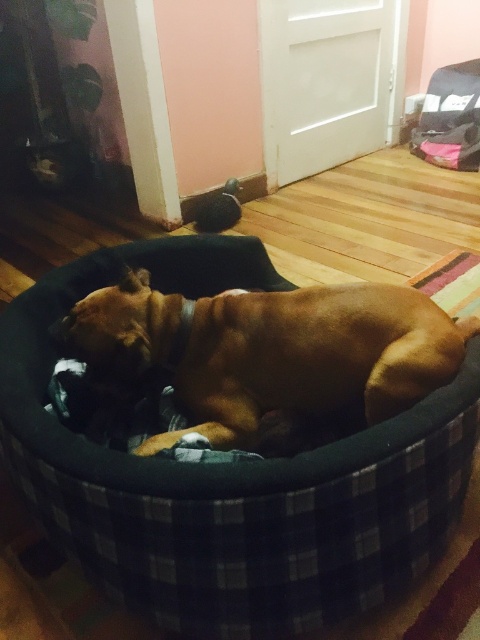
You want to buy a new pet bed for your brown velvety dog at center. The current black plaid dog bed at center is too small. What should you look for in terms of size when purchasing the new bed?

The black plaid dog bed at center has a larger size compared to brown velvety dog at center, so you should look for a bed that is even larger than the current one to ensure comfort and proper fit for the brown velvety dog at center.

You are a dog owner who wants to place a new toy in the black plaid dog bed at center. However, the brown velvety dog at center is currently lying in it. Based on their positions, can you tell me if the toy can be placed in the bed without disturbing the dog?

The black plaid dog bed at center is to the left of the brown velvety dog at center, meaning the dog is positioned to the right side of the bed. Since the dog is only occupying part of the bed, there might still be space on the left side to place the toy without disturbing the dog.